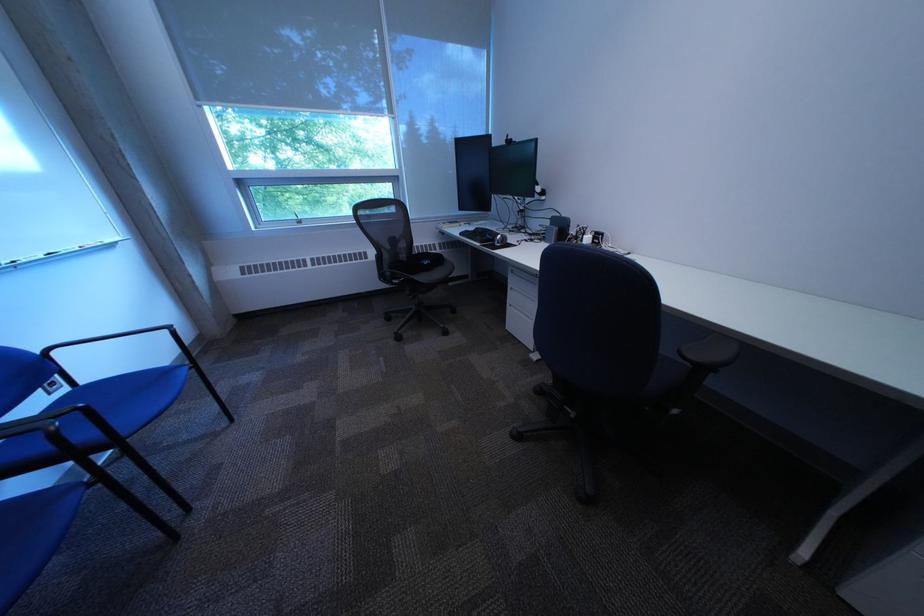
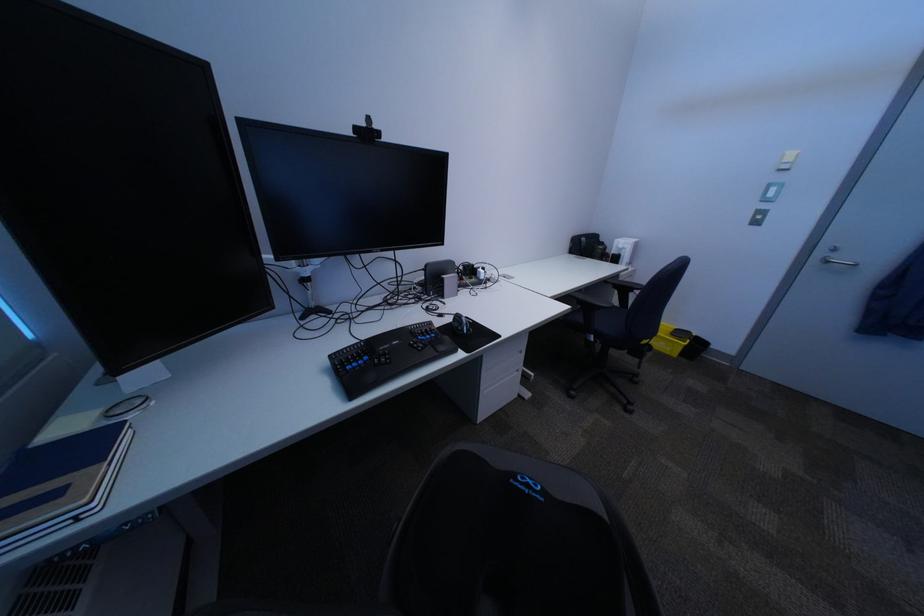
In the second image, find the point that corresponds to (521,143) in the first image.

(371, 131)